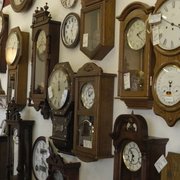
At what (x,y) coordinates should I click in order to perform the action: click on wall. Please return your answer as a coordinate pair (x, y). This screenshot has height=180, width=180. Looking at the image, I should click on (70, 56), (90, 172), (175, 140).